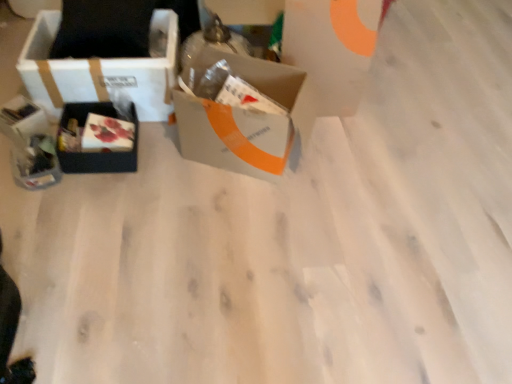
You are a GUI agent. You are given a task and a screenshot of the screen. Output one action in this format:
    pyautogui.click(x=<x>, y=<y>)
    Task: Click on the vacant area situated below matte black gift box at left, which ranks as the first gift box in bottom-to-top order (from a real-world perspective)
    Image resolution: width=512 pixels, height=384 pixels.
    Given the screenshot: What is the action you would take?
    pyautogui.click(x=42, y=174)